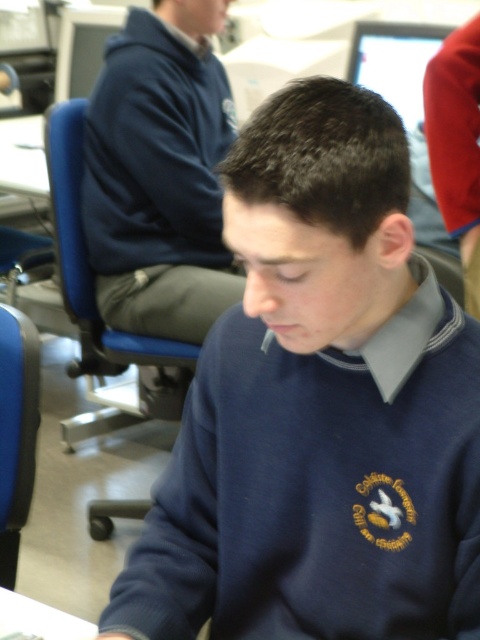
Who is positioned more to the right, navy blue sweater at center or dark blue hoodie at upper left?

Positioned to the right is navy blue sweater at center.

Can you confirm if navy blue sweater at center is positioned below dark blue hoodie at upper left?

Indeed, navy blue sweater at center is positioned under dark blue hoodie at upper left.

This screenshot has width=480, height=640. What do you see at coordinates (319, 406) in the screenshot? I see `navy blue sweater at center` at bounding box center [319, 406].

The image size is (480, 640). I want to click on navy blue sweater at center, so click(x=319, y=406).